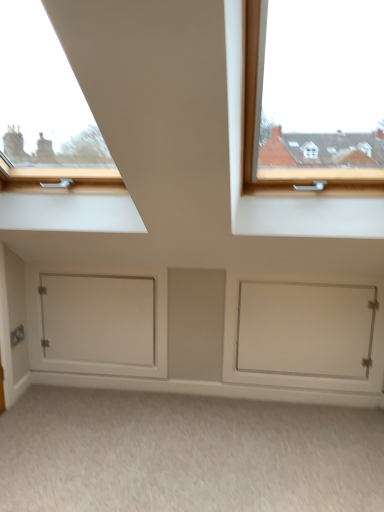
What do you see at coordinates (305, 329) in the screenshot?
I see `white matte door at lower right, the first door when ordered from right to left` at bounding box center [305, 329].

What is the approximate width of white matte door at lower right, the first door when ordered from right to left?

white matte door at lower right, the first door when ordered from right to left, is 1.49 inches in width.

Image resolution: width=384 pixels, height=512 pixels. What are the coordinates of `beige carpet at lower center` in the screenshot? It's located at (186, 453).

Looking at this image, in terms of width, does beige carpet at lower center look wider or thinner when compared to white matte door at lower right, the first door when ordered from right to left?

beige carpet at lower center is wider than white matte door at lower right, the first door when ordered from right to left.

Which of these two, beige carpet at lower center or white matte door at lower right, which is the second door in left-to-right order, stands taller?

white matte door at lower right, which is the second door in left-to-right order.

How distant is beige carpet at lower center from white matte door at lower right, which is the second door in left-to-right order?

beige carpet at lower center and white matte door at lower right, which is the second door in left-to-right order, are 23.46 inches apart.

Is beige carpet at lower center positioned far away from white matte door at lower right, which is the second door in left-to-right order?

No, there isn't a large distance between beige carpet at lower center and white matte door at lower right, which is the second door in left-to-right order.

Is white matte door at lower left, the first door when ordered from left to right, behind white matte door at lower right, the first door when ordered from right to left?

Yes, white matte door at lower left, the first door when ordered from left to right, is further from the camera.

Which of these two, white matte door at lower left, which is the 2th door in right-to-left order, or white matte door at lower right, which is the second door in left-to-right order, stands taller?

Standing taller between the two is white matte door at lower right, which is the second door in left-to-right order.

Can you confirm if white matte door at lower left, which is the 2th door in right-to-left order, is positioned to the left of white matte door at lower right, the first door when ordered from right to left?

Yes.

Who is smaller, white matte door at lower left, the first door when ordered from left to right, or white matte door at lower right, which is the second door in left-to-right order?

Smaller between the two is white matte door at lower left, the first door when ordered from left to right.

Does beige carpet at lower center have a lesser width compared to white matte door at lower left, the first door when ordered from left to right?

In fact, beige carpet at lower center might be wider than white matte door at lower left, the first door when ordered from left to right.

Which is behind, beige carpet at lower center or white matte door at lower left, which is the 2th door in right-to-left order?

white matte door at lower left, which is the 2th door in right-to-left order.

Could you measure the distance between beige carpet at lower center and white matte door at lower left, the first door when ordered from left to right?

The distance of beige carpet at lower center from white matte door at lower left, the first door when ordered from left to right, is 24.14 inches.

Considering the points (176, 433) and (122, 367), which point is in front, point (176, 433) or point (122, 367)?

The point (176, 433) is closer to the camera.

Is point (301, 371) farther from viewer compared to point (284, 438)?

Yes.

Considering the relative positions of white matte door at lower right, the first door when ordered from right to left, and beige carpet at lower center in the image provided, is white matte door at lower right, the first door when ordered from right to left, to the left or to the right of beige carpet at lower center?

white matte door at lower right, the first door when ordered from right to left, is to the right of beige carpet at lower center.

Can you confirm if white matte door at lower right, which is the second door in left-to-right order, is smaller than beige carpet at lower center?

Correct, white matte door at lower right, which is the second door in left-to-right order, occupies less space than beige carpet at lower center.

In terms of height, does white matte door at lower right, the first door when ordered from right to left, look taller or shorter compared to beige carpet at lower center?

Considering their sizes, white matte door at lower right, the first door when ordered from right to left, has more height than beige carpet at lower center.

Is white matte door at lower left, which is the 2th door in right-to-left order, to the left or to the right of beige carpet at lower center in the image?

In the image, white matte door at lower left, which is the 2th door in right-to-left order, appears on the left side of beige carpet at lower center.

Considering the sizes of white matte door at lower left, the first door when ordered from left to right, and beige carpet at lower center in the image, is white matte door at lower left, the first door when ordered from left to right, bigger or smaller than beige carpet at lower center?

Clearly, white matte door at lower left, the first door when ordered from left to right, is smaller in size than beige carpet at lower center.

From a real-world perspective, is white matte door at lower left, which is the 2th door in right-to-left order, located beneath beige carpet at lower center?

No.

Is white matte door at lower left, the first door when ordered from left to right, looking in the opposite direction of beige carpet at lower center?

That's not correct — white matte door at lower left, the first door when ordered from left to right, is not looking away from beige carpet at lower center.

Is the surface of white matte door at lower right, the first door when ordered from right to left, in direct contact with white matte door at lower left, which is the 2th door in right-to-left order?

No, white matte door at lower right, the first door when ordered from right to left, is not with white matte door at lower left, which is the 2th door in right-to-left order.

Considering the relative sizes of white matte door at lower right, which is the second door in left-to-right order, and white matte door at lower left, which is the 2th door in right-to-left order, in the image provided, is white matte door at lower right, which is the second door in left-to-right order, taller than white matte door at lower left, which is the 2th door in right-to-left order,?

Correct, white matte door at lower right, which is the second door in left-to-right order, is much taller as white matte door at lower left, which is the 2th door in right-to-left order.

From the image's perspective, is white matte door at lower right, which is the second door in left-to-right order, on white matte door at lower left, the first door when ordered from left to right?

No, from the image's perspective, white matte door at lower right, which is the second door in left-to-right order, is not over white matte door at lower left, the first door when ordered from left to right.

Is white matte door at lower right, the first door when ordered from right to left, completely or partially outside of white matte door at lower left, the first door when ordered from left to right?

Yes.

You are a GUI agent. You are given a task and a screenshot of the screen. Output one action in this format:
    pyautogui.click(x=<x>, y=<y>)
    Task: Click on the plain below the white matte door at lower right, which is the second door in left-to-right order (from the image's perspective)
    
    Given the screenshot: What is the action you would take?
    pyautogui.click(x=186, y=453)

I want to click on door lying on the right of white matte door at lower left, which is the 2th door in right-to-left order, so click(x=305, y=329).

When comparing their distances from white matte door at lower right, the first door when ordered from right to left, does white matte door at lower left, which is the 2th door in right-to-left order, or beige carpet at lower center seem closer?

beige carpet at lower center is positioned closer to the anchor white matte door at lower right, the first door when ordered from right to left.

From the image, which object appears to be nearer to beige carpet at lower center, white matte door at lower left, which is the 2th door in right-to-left order, or white matte door at lower right, which is the second door in left-to-right order?

white matte door at lower right, which is the second door in left-to-right order.

In the scene shown: Which object lies nearer to the anchor point white matte door at lower left, the first door when ordered from left to right, beige carpet at lower center or white matte door at lower right, the first door when ordered from right to left?

beige carpet at lower center is closer to white matte door at lower left, the first door when ordered from left to right.

Which object lies nearer to the anchor point white matte door at lower left, the first door when ordered from left to right, white matte door at lower right, the first door when ordered from right to left, or beige carpet at lower center?

The object closer to white matte door at lower left, the first door when ordered from left to right, is beige carpet at lower center.

Looking at the image, which one is located further to beige carpet at lower center, white matte door at lower right, the first door when ordered from right to left, or white matte door at lower left, which is the 2th door in right-to-left order?

The object further to beige carpet at lower center is white matte door at lower left, which is the 2th door in right-to-left order.

From the image, which object appears to be nearer to white matte door at lower right, the first door when ordered from right to left, beige carpet at lower center or white matte door at lower left, the first door when ordered from left to right?

Among the two, beige carpet at lower center is located nearer to white matte door at lower right, the first door when ordered from right to left.

Where is `plain between white matte door at lower left, the first door when ordered from left to right, and white matte door at lower right, which is the second door in left-to-right order, from left to right`? plain between white matte door at lower left, the first door when ordered from left to right, and white matte door at lower right, which is the second door in left-to-right order, from left to right is located at coordinates (186, 453).